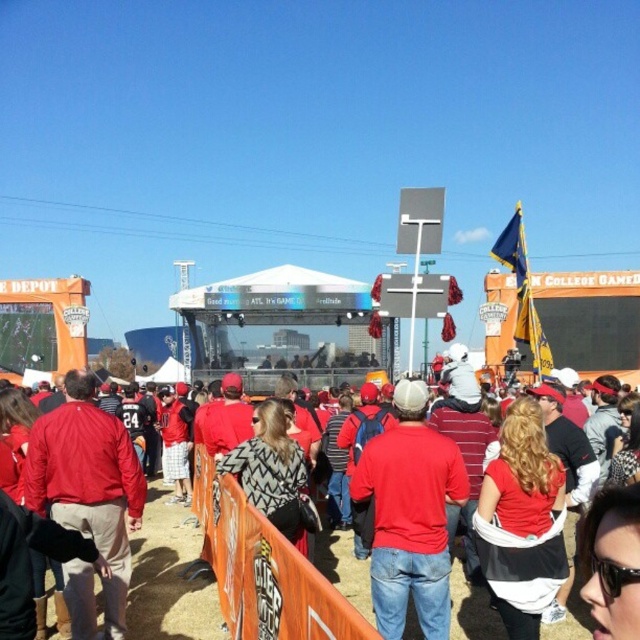
You are a photographer standing at the edge of the crowd. You want to take a photo of the matte red shirt at center and the red fabric jacket at center. If your camera has a maximum focus range of 30 feet, will both subjects be in focus?

The matte red shirt at center is 37.66 feet away from the red fabric jacket at center. Since the camera can only focus up to 30 feet, the distance between them exceeds the focus range. Therefore, both subjects cannot be in focus simultaneously.

You are a photographer at the event and want to capture a photo of both the red fabric jacket at center and the matte red jacket at center. Which jacket should you focus on first if you want to include both in your frame without adjusting your camera angle?

You should focus on the matte red jacket at center first because it is taller than the red fabric jacket at center, ensuring it fits within the frame when capturing both.